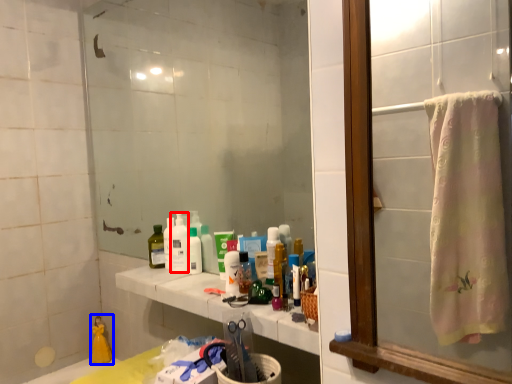
Question: Which object is closer to the camera taking this photo, cleaning product (highlighted by a red box) or product (highlighted by a blue box)?

Choices:
 (A) cleaning product
 (B) product

Answer: (A)